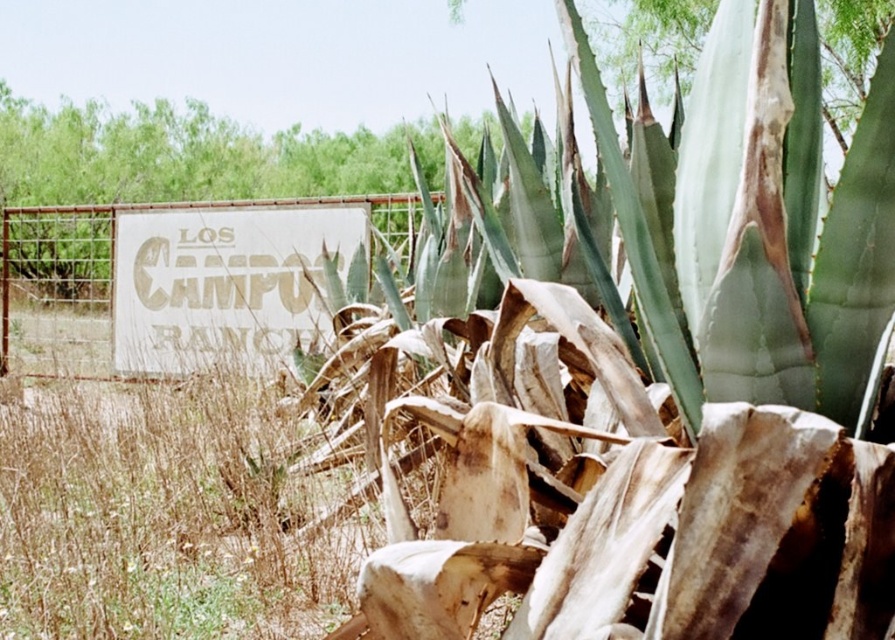
Question: Which point is farther from the camera taking this photo?

Choices:
 (A) (109, 301)
 (B) (270, 291)

Answer: (A)

Question: Can you confirm if white textured sign at center is positioned above rusty metal fence at left?

Choices:
 (A) yes
 (B) no

Answer: (B)

Question: Considering the relative positions of white textured sign at center and rusty metal fence at left in the image provided, where is white textured sign at center located with respect to rusty metal fence at left?

Choices:
 (A) right
 (B) left

Answer: (A)

Question: Does white textured sign at center appear on the left side of rusty metal fence at left?

Choices:
 (A) no
 (B) yes

Answer: (A)